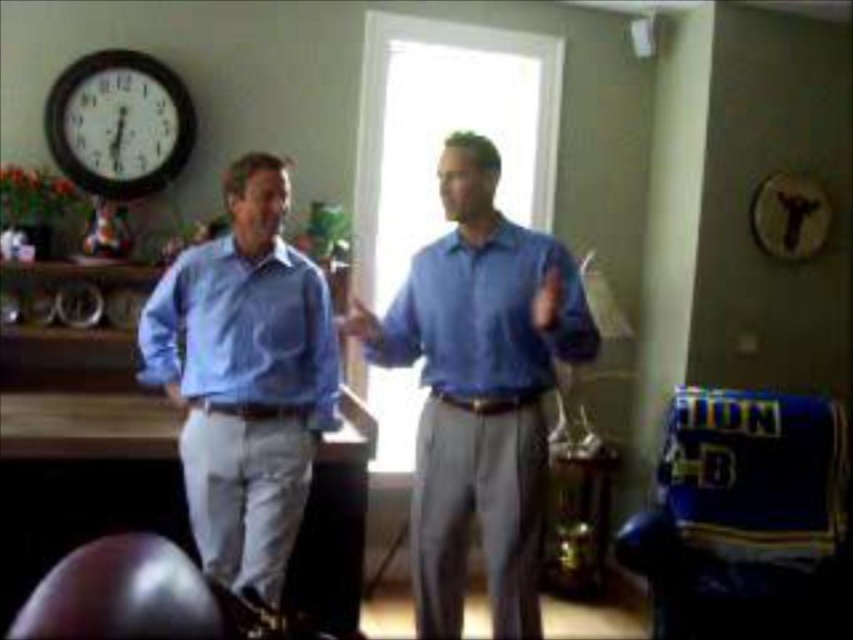
You are standing in the home office and want to reach a point that is exactly at coordinates point (270, 374). If you are currently 2 meters away from that point, how many more meters do you need to move forward to reach it?

The point (270, 374) is 2.76 meters away from the viewer. Since you are currently 2 meters away, you need to move an additional 0.76 meters forward to reach it.

You are a photographer who needs to take a photo of the light blue cotton shirt at left from a distance of 2.5 meters. Is the camera currently positioned at the correct distance?

The light blue cotton shirt at left and camera are 2.66 meters apart, so the camera is positioned 0.16 meters too far away to capture the shirt from exactly 2.5 meters away.